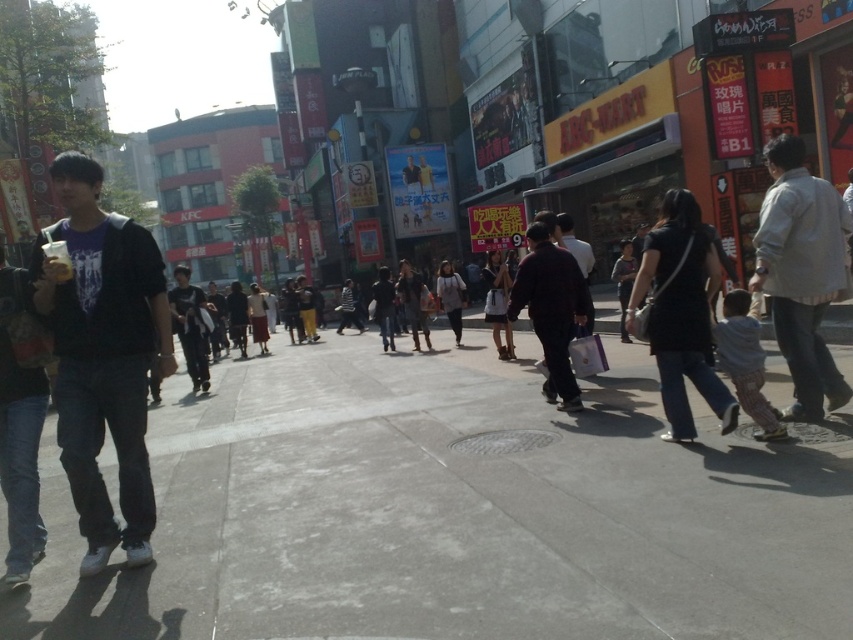
Between dark brown leather jacket at center and dark gray hoodie at center, which one has more height?

With more height is dark gray hoodie at center.

Does dark brown leather jacket at center appear on the left side of dark gray hoodie at center?

In fact, dark brown leather jacket at center is to the right of dark gray hoodie at center.

Is point (552, 285) positioned after point (206, 336)?

No, (552, 285) is closer to viewer.

Image resolution: width=853 pixels, height=640 pixels. Identify the location of dark brown leather jacket at center. (550, 308).

Based on the photo, can you confirm if gray concrete pavement at center is thinner than dark brown leather jacket at center?

In fact, gray concrete pavement at center might be wider than dark brown leather jacket at center.

Does gray concrete pavement at center appear on the right side of dark brown leather jacket at center?

Incorrect, gray concrete pavement at center is not on the right side of dark brown leather jacket at center.

The image size is (853, 640). What do you see at coordinates (456, 512) in the screenshot?
I see `gray concrete pavement at center` at bounding box center [456, 512].

You are a GUI agent. You are given a task and a screenshot of the screen. Output one action in this format:
    pyautogui.click(x=<x>, y=<y>)
    Task: Click on the gray concrete pavement at center
    
    Given the screenshot: What is the action you would take?
    pyautogui.click(x=456, y=512)

Is black matte jacket at left taller than dark gray hoodie at center?

Incorrect, black matte jacket at left's height is not larger of dark gray hoodie at center's.

Which is behind, point (59, 396) or point (194, 308)?

The point (194, 308) is more distant.

I want to click on black matte jacket at left, so click(x=103, y=355).